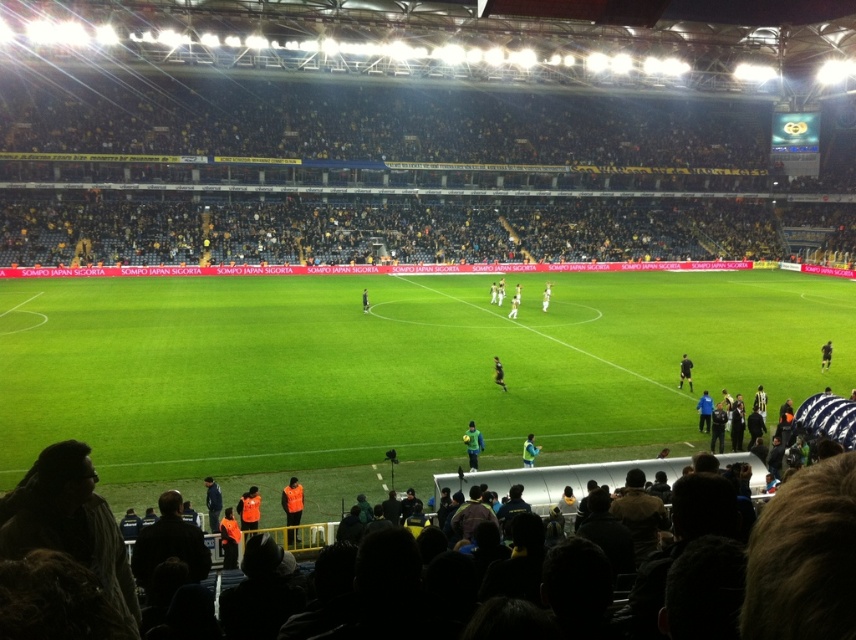
In the scene shown: Can you confirm if orange reflective vest at lower center is positioned to the left of white matte soccer player at center?

Correct, you'll find orange reflective vest at lower center to the left of white matte soccer player at center.

Which is in front, point (284, 509) or point (516, 301)?

Point (284, 509)

This screenshot has width=856, height=640. I want to click on orange reflective vest at lower center, so click(292, 508).

Is blue fabric jacket at lower left wider than dark blue jersey at center?

Correct, the width of blue fabric jacket at lower left exceeds that of dark blue jersey at center.

You are a GUI agent. You are given a task and a screenshot of the screen. Output one action in this format:
    pyautogui.click(x=<x>, y=<y>)
    Task: Click on the blue fabric jacket at lower left
    This screenshot has width=856, height=640.
    Given the screenshot: What is the action you would take?
    pyautogui.click(x=212, y=502)

Is point (513, 300) positioned before point (367, 310)?

Yes, it is.

Who is taller, white matte soccer player at center or black jersey at center?

With more height is white matte soccer player at center.

Does point (510, 298) come behind point (367, 298)?

Yes, it is behind point (367, 298).

The image size is (856, 640). I want to click on white matte soccer player at center, so click(513, 307).